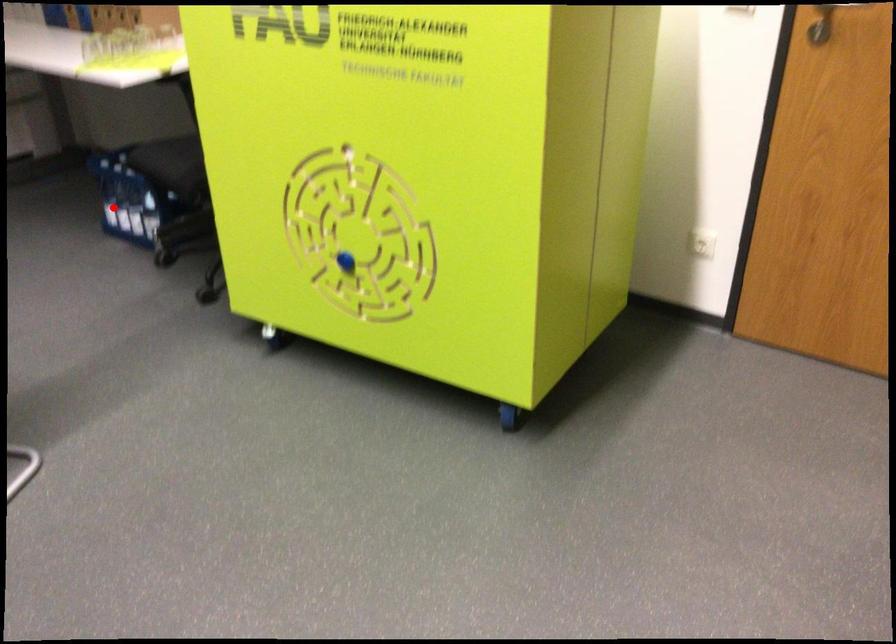
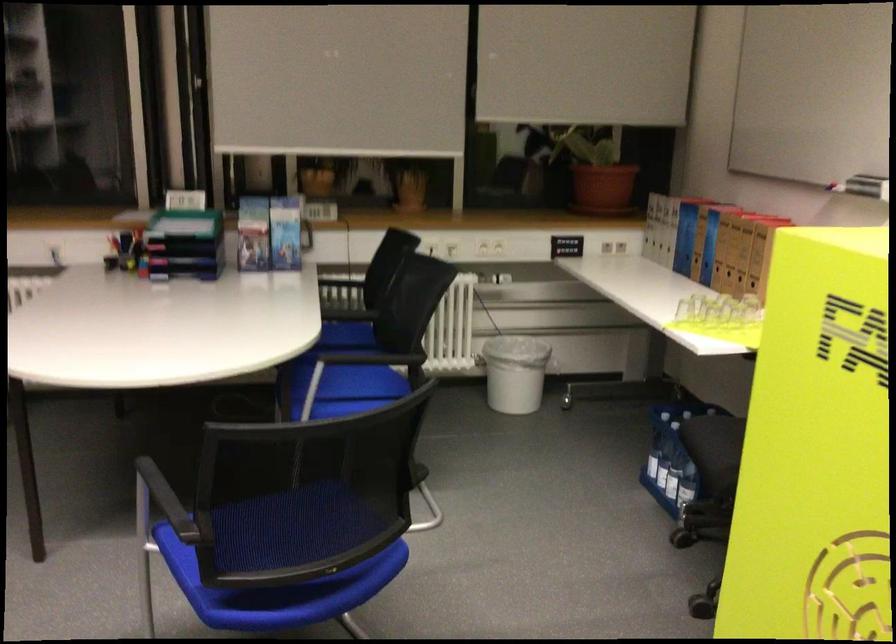
Question: I am providing you with two images of the same scene from different viewpoints. Given a red point in image1, look at the same physical point in image2. Is it:

Choices:
 (A) Closer to the viewpoint
 (B) Farther from the viewpoint

Answer: (A)